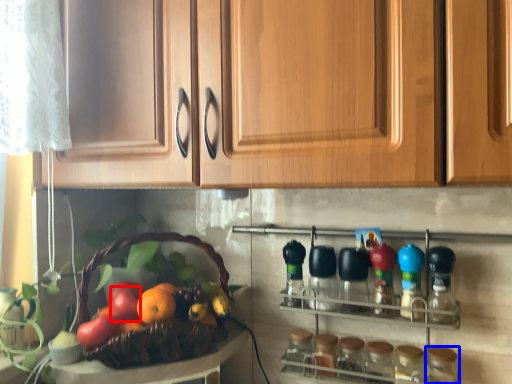
Question: Which point is further to the camera, apple (highlighted by a red box) or bottle (highlighted by a blue box)?

Choices:
 (A) apple
 (B) bottle

Answer: (A)